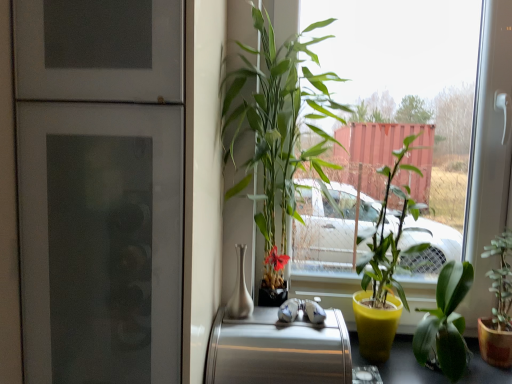
This screenshot has width=512, height=384. In order to click on vacant region above smooth black table at lower right (from a real-world perspective) in this screenshot , I will do `click(418, 363)`.